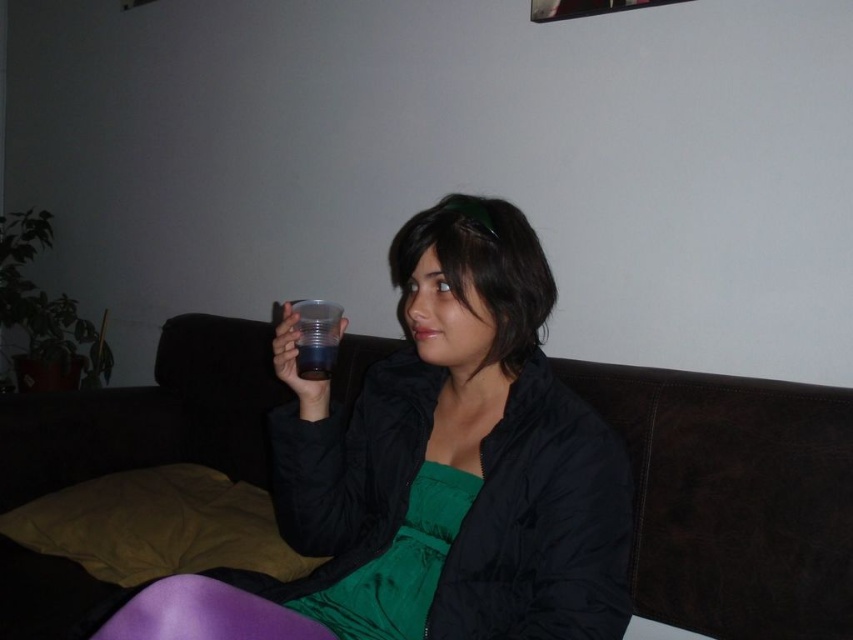
Is green satin dress at center thinner than transparent plastic cup at upper center?

In fact, green satin dress at center might be wider than transparent plastic cup at upper center.

Does point (314, 595) come farther from viewer compared to point (302, 300)?

No.

Between point (393, 592) and point (328, 340), which one is positioned behind?

Positioned behind is point (328, 340).

I want to click on green satin dress at center, so [x=399, y=564].

This screenshot has height=640, width=853. What are the coordinates of `brown leather couch at center` in the screenshot? It's located at (732, 499).

Does brown leather couch at center lie in front of transparent plastic cup at upper center?

No, it is behind transparent plastic cup at upper center.

Where is `brown leather couch at center`? This screenshot has height=640, width=853. brown leather couch at center is located at coordinates (732, 499).

Can you confirm if brown leather couch at center is positioned above green satin dress at center?

A: Indeed, brown leather couch at center is positioned over green satin dress at center.

Does brown leather couch at center have a greater height compared to green satin dress at center?

Indeed, brown leather couch at center has a greater height compared to green satin dress at center.

Who is more distant from viewer, (105, 472) or (351, 588)?

The point (105, 472) is behind.

Locate an element on the screen. Image resolution: width=853 pixels, height=640 pixels. brown leather couch at center is located at coordinates (732, 499).